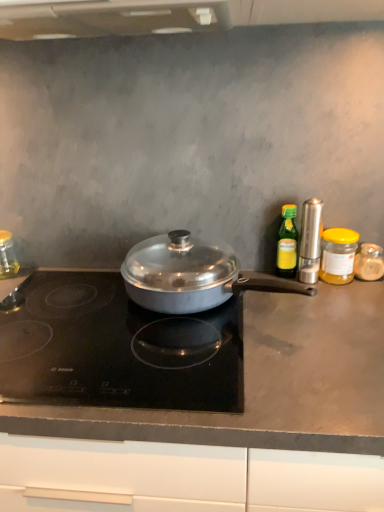
Locate an element on the screen. free spot in front of yellow glass jar at right, arranged as the 2th kitchen appliance when viewed from the right is located at coordinates (341, 305).